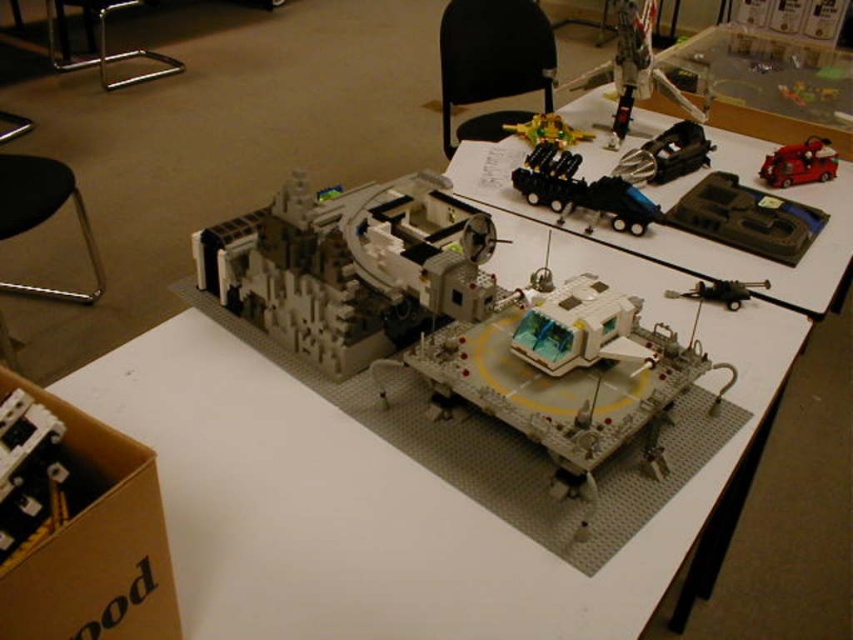
Question: Among these points, which one is farthest from the camera?

Choices:
 (A) (564, 314)
 (B) (548, 134)
 (C) (659, 138)

Answer: (B)

Question: Does white plastic spaceship at center have a larger size compared to shiny gold spaceship at upper center?

Choices:
 (A) no
 (B) yes

Answer: (B)

Question: Can you confirm if white plastic spaceship at center is smaller than shiny gold spaceship at upper center?

Choices:
 (A) yes
 (B) no

Answer: (B)

Question: Which of the following is the farthest from the observer?

Choices:
 (A) shiny red car at upper right
 (B) metallic silver gun at center

Answer: (A)

Question: Which object is positioned farthest from the white plastic spaceship at center?

Choices:
 (A) shiny gold spaceship at upper center
 (B) black metal stool at lower left

Answer: (B)

Question: Is white plastic spaceship at center thinner than shiny gold spaceship at upper center?

Choices:
 (A) no
 (B) yes

Answer: (A)